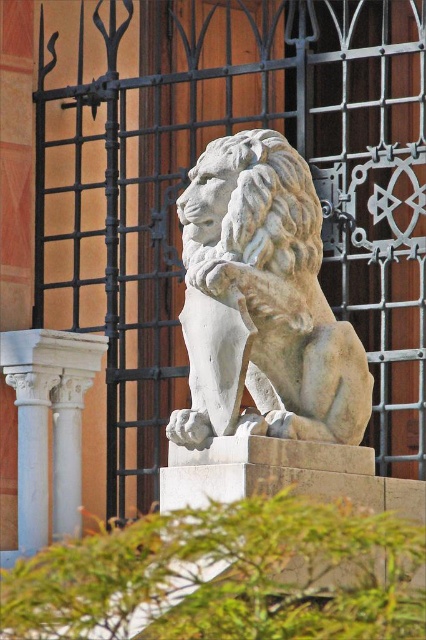
You are standing in front of a stone lion statue and a large metal gate. You notice a specific point marked at coordinates (262,301). What object is located at this point?

The white stone lion at center is located at point (262,301).

You are a maintenance worker needing to reach the white stone lion at center from the white marble column at lower left. Given that your equipment can only move 20 meters, can you safely reach the lion without needing additional tools?

The distance between the white stone lion at center and the white marble column at lower left is 25.51 meters. Since your equipment can only move 20 meters, you cannot safely reach the lion without additional tools.